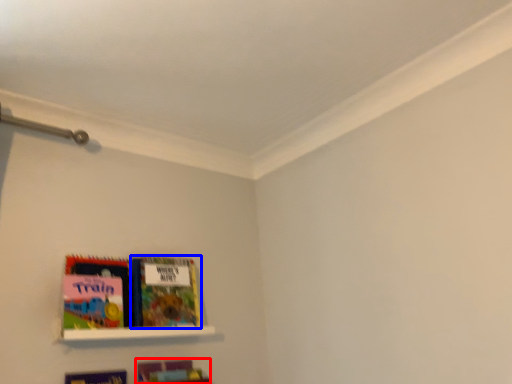
Question: Which of the following is the closest to the observer, book (highlighted by a red box) or book (highlighted by a blue box)?

Choices:
 (A) book
 (B) book

Answer: (A)